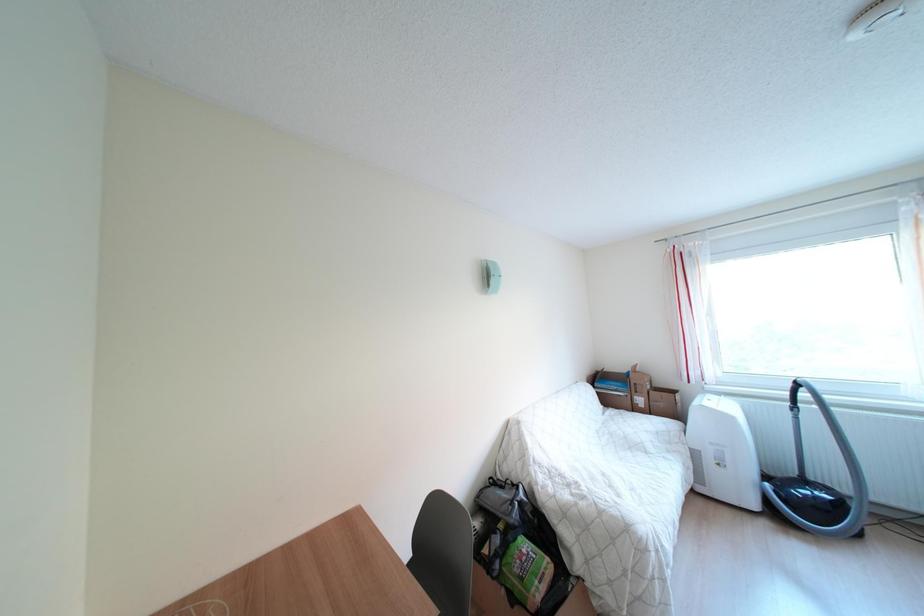
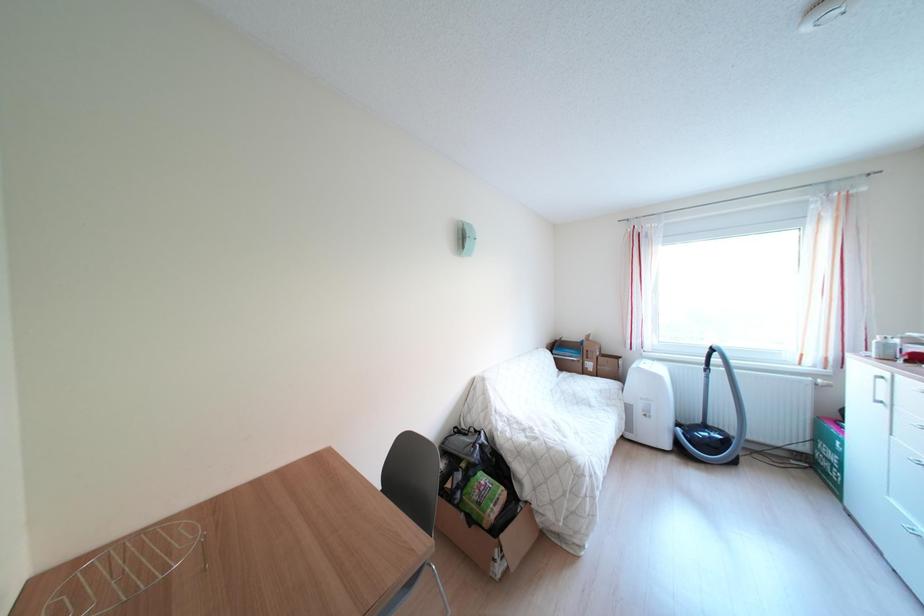
Question: The first image is from the beginning of the video and the second image is from the end. How did the camera likely rotate when shooting the video?

Choices:
 (A) Left
 (B) Right
 (C) Up
 (D) Down

Answer: (B)